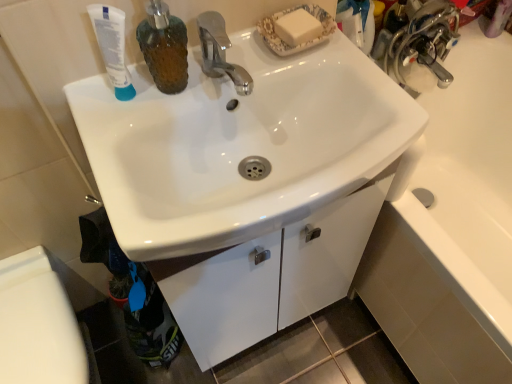
Image resolution: width=512 pixels, height=384 pixels. What are the coordinates of `free point in front of white matte tube at upper left` in the screenshot? It's located at (126, 161).